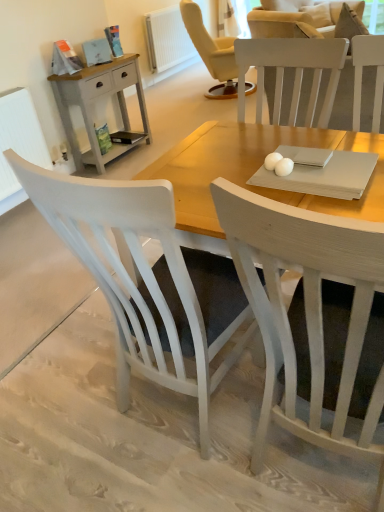
Where is `matte gray wooden nightstand at left`? matte gray wooden nightstand at left is located at coordinates (94, 103).

This screenshot has height=512, width=384. In order to click on white textured radiator at left, which is the first radiator in front-to-back order in this screenshot , I will do `click(19, 141)`.

I want to click on white wood chair at center, which is the first chair from right to left, so click(x=306, y=308).

How much space does white painted radiator at upper center, which is the second radiator from left to right, occupy vertically?

white painted radiator at upper center, which is the second radiator from left to right, is 33.97 inches in height.

I want to click on matte gray wooden nightstand at left, so click(94, 103).

Can you see white painted radiator at upper center, the first radiator from the right, touching white wood chair at center, positioned as the first chair in left-to-right order?

No, white painted radiator at upper center, the first radiator from the right, is not next to white wood chair at center, positioned as the first chair in left-to-right order.

Between white painted radiator at upper center, positioned as the 1th radiator in back-to-front order, and white wood chair at center, which is the 2th chair in right-to-left order, which one has larger width?

Wider between the two is white wood chair at center, which is the 2th chair in right-to-left order.

How distant is white painted radiator at upper center, the 1th radiator in the top-to-bottom sequence, from white wood chair at center, positioned as the first chair in left-to-right order?

white painted radiator at upper center, the 1th radiator in the top-to-bottom sequence, and white wood chair at center, positioned as the first chair in left-to-right order, are 5.47 meters apart from each other.

Is point (159, 38) less distant than point (230, 308)?

No, (159, 38) is behind (230, 308).

Which object is closer to the camera, matte gray wooden nightstand at left or white wood chair at center, positioned as the first chair in left-to-right order?

white wood chair at center, positioned as the first chair in left-to-right order, is in front.

How different are the orientations of matte gray wooden nightstand at left and white wood chair at center, which is the 2th chair in right-to-left order, in degrees?

matte gray wooden nightstand at left and white wood chair at center, which is the 2th chair in right-to-left order, are facing 91.2 degrees away from each other.

Considering the relative positions of matte gray wooden nightstand at left and white wood chair at center, which is the 2th chair in right-to-left order, in the image provided, is matte gray wooden nightstand at left to the left or to the right of white wood chair at center, which is the 2th chair in right-to-left order,?

From the image, it's evident that matte gray wooden nightstand at left is to the left of white wood chair at center, which is the 2th chair in right-to-left order.

From the image's perspective, is white wood chair at center, which is the 2th chair in right-to-left order, positioned above or below white wood chair at center, which is the first chair from right to left?

white wood chair at center, which is the 2th chair in right-to-left order, is situated higher than white wood chair at center, which is the first chair from right to left, in the image.

From a real-world perspective, who is located lower, white wood chair at center, positioned as the first chair in left-to-right order, or white wood chair at center, which appears as the second chair when viewed from the left?

From a 3D spatial view, white wood chair at center, which appears as the second chair when viewed from the left, is below.

In order to click on chair behind the white wood chair at center, which is the first chair from right to left in this screenshot , I will do `click(147, 280)`.

In terms of height, does white wood chair at center, positioned as the first chair in left-to-right order, look taller or shorter compared to white wood chair at center, which is the first chair from right to left?

Clearly, white wood chair at center, positioned as the first chair in left-to-right order, is taller compared to white wood chair at center, which is the first chair from right to left.

This screenshot has width=384, height=512. Find the location of `nightstand that appears below the white painted radiator at upper center, which is the second radiator from left to right (from a real-world perspective)`. nightstand that appears below the white painted radiator at upper center, which is the second radiator from left to right (from a real-world perspective) is located at coordinates (94, 103).

Is matte gray wooden nightstand at left with white painted radiator at upper center, which is counted as the second radiator, starting from the bottom?

No, matte gray wooden nightstand at left is not beside white painted radiator at upper center, which is counted as the second radiator, starting from the bottom.

Is matte gray wooden nightstand at left inside or outside of white painted radiator at upper center, the first radiator from the right?

matte gray wooden nightstand at left is not inside white painted radiator at upper center, the first radiator from the right, it's outside.

What's the angular difference between white textured radiator at left, which is the first radiator from bottom to top, and white wood chair at center, which is the 2th chair in right-to-left order,'s facing directions?

The angle between the facing direction of white textured radiator at left, which is the first radiator from bottom to top, and the facing direction of white wood chair at center, which is the 2th chair in right-to-left order, is 90.6 degrees.

Is point (3, 147) farther from camera compared to point (149, 301)?

Yes.

From a real-world perspective, which is physically above, white textured radiator at left, the 1th radiator viewed from the left, or white wood chair at center, positioned as the first chair in left-to-right order?

white wood chair at center, positioned as the first chair in left-to-right order, is physically above.

The height and width of the screenshot is (512, 384). Identify the location of the 1st radiator positioned below the white wood chair at center, which is the 2th chair in right-to-left order (from a real-world perspective). (19, 141).

Between point (248, 191) and point (90, 70), which one is positioned behind?

Point (90, 70)

Who is bigger, white wood chair at center, which appears as the second chair when viewed from the left, or matte gray wooden nightstand at left?

white wood chair at center, which appears as the second chair when viewed from the left, is bigger.

How many degrees apart are the facing directions of white wood chair at center, which appears as the second chair when viewed from the left, and matte gray wooden nightstand at left?

The facing directions of white wood chair at center, which appears as the second chair when viewed from the left, and matte gray wooden nightstand at left are 91.2 degrees apart.

Is white wood chair at center, which appears as the second chair when viewed from the left, far away from matte gray wooden nightstand at left?

white wood chair at center, which appears as the second chair when viewed from the left, is far away from matte gray wooden nightstand at left.

From the picture: Is white painted radiator at upper center, the 1th radiator in the top-to-bottom sequence, facing towards white textured radiator at left, the 1th radiator viewed from the left?

No, white painted radiator at upper center, the 1th radiator in the top-to-bottom sequence, is not oriented towards white textured radiator at left, the 1th radiator viewed from the left.

From a real-world perspective, between white painted radiator at upper center, the 1th radiator in the top-to-bottom sequence, and white textured radiator at left, which is the first radiator in front-to-back order, who is vertically higher?

white textured radiator at left, which is the first radiator in front-to-back order, is physically above.

Is white painted radiator at upper center, the 2th radiator viewed from the front, outside of white textured radiator at left, the 2th radiator from the top?

That's correct, white painted radiator at upper center, the 2th radiator viewed from the front, is outside of white textured radiator at left, the 2th radiator from the top.

Is white painted radiator at upper center, the 2th radiator viewed from the front, next to white textured radiator at left, the 1th radiator viewed from the left?

white painted radiator at upper center, the 2th radiator viewed from the front, is not next to white textured radiator at left, the 1th radiator viewed from the left, and they're not touching.

Where is `the 1st chair to the right when counting from the white painted radiator at upper center, the first radiator from the right`? This screenshot has width=384, height=512. the 1st chair to the right when counting from the white painted radiator at upper center, the first radiator from the right is located at coordinates (147, 280).

From a real-world perspective, starting from the matte gray wooden nightstand at left, which chair is the 2nd one vertically above it? Please provide its 2D coordinates.

[(147, 280)]

Which object lies nearer to the anchor point white painted radiator at upper center, the 2th radiator viewed from the front, white wood chair at center, positioned as the first chair in left-to-right order, or white textured radiator at left, the 2th radiator from the top?

The object closer to white painted radiator at upper center, the 2th radiator viewed from the front, is white textured radiator at left, the 2th radiator from the top.

Considering their positions, is white wood chair at center, which is the 2th chair in right-to-left order, positioned further to matte gray wooden nightstand at left than white textured radiator at left, which is the first radiator from bottom to top?

Among the two, white wood chair at center, which is the 2th chair in right-to-left order, is located further to matte gray wooden nightstand at left.

When comparing their distances from white painted radiator at upper center, which is counted as the second radiator, starting from the bottom, does white wood chair at center, which is the 2th chair in right-to-left order, or matte gray wooden nightstand at left seem closer?

matte gray wooden nightstand at left.

Which object lies nearer to the anchor point white textured radiator at left, which is the first radiator from bottom to top, matte gray wooden nightstand at left or white wood chair at center, which is the 2th chair in right-to-left order?

The object closer to white textured radiator at left, which is the first radiator from bottom to top, is matte gray wooden nightstand at left.

From the image, which object appears to be farther from matte gray wooden nightstand at left, white textured radiator at left, which is the first radiator in front-to-back order, or white painted radiator at upper center, the 1th radiator in the top-to-bottom sequence?

Among the two, white painted radiator at upper center, the 1th radiator in the top-to-bottom sequence, is located further to matte gray wooden nightstand at left.

From the image, which object appears to be farther from white painted radiator at upper center, the first radiator from the right, matte gray wooden nightstand at left or white wood chair at center, which appears as the second chair when viewed from the left?

white wood chair at center, which appears as the second chair when viewed from the left, is positioned further to the anchor white painted radiator at upper center, the first radiator from the right.

Estimate the real-world distances between objects in this image. Which object is further from white textured radiator at left, the 1th radiator viewed from the left, white wood chair at center, which appears as the second chair when viewed from the left, or matte gray wooden nightstand at left?

white wood chair at center, which appears as the second chair when viewed from the left, is further to white textured radiator at left, the 1th radiator viewed from the left.

Looking at the image, which one is located further to white wood chair at center, which is the 2th chair in right-to-left order, white painted radiator at upper center, the first radiator from the right, or white textured radiator at left, the 1th radiator viewed from the left?

The object further to white wood chair at center, which is the 2th chair in right-to-left order, is white painted radiator at upper center, the first radiator from the right.

The image size is (384, 512). I want to click on radiator between white wood chair at center, which is the first chair from right to left, and white painted radiator at upper center, the 1th radiator in the top-to-bottom sequence, from front to back, so click(x=19, y=141).

You are a GUI agent. You are given a task and a screenshot of the screen. Output one action in this format:
    pyautogui.click(x=<x>, y=<y>)
    Task: Click on the chair between white wood chair at center, which appears as the second chair when viewed from the left, and matte gray wooden nightstand at left from front to back
    The height and width of the screenshot is (512, 384).
    Given the screenshot: What is the action you would take?
    pyautogui.click(x=147, y=280)

At what (x,y) coordinates should I click in order to perform the action: click on nightstand between white textured radiator at left, the 1th radiator viewed from the left, and white painted radiator at upper center, which is counted as the second radiator, starting from the bottom, from front to back. Please return your answer as a coordinate pair (x, y). Looking at the image, I should click on (94, 103).

Locate an element on the screen. This screenshot has height=512, width=384. nightstand between white wood chair at center, positioned as the first chair in left-to-right order, and white painted radiator at upper center, which is the second radiator from left to right, in the front-back direction is located at coordinates (94, 103).